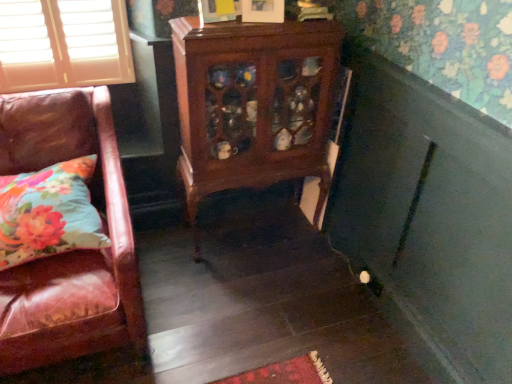
What are the coordinates of `vacant space underneath mahogany cabinet at center (from a real-world perspective)` in the screenshot? It's located at (252, 235).